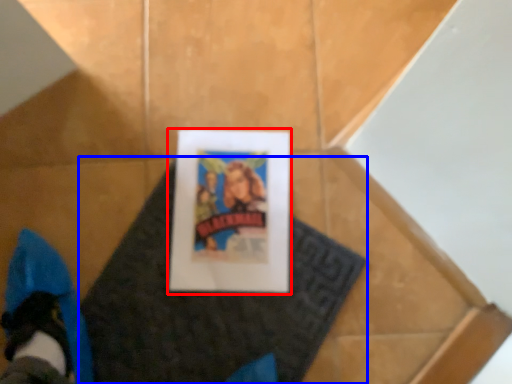
Question: Among these objects, which one is farthest to the camera, picture frame (highlighted by a red box) or blanket (highlighted by a blue box)?

Choices:
 (A) picture frame
 (B) blanket

Answer: (A)